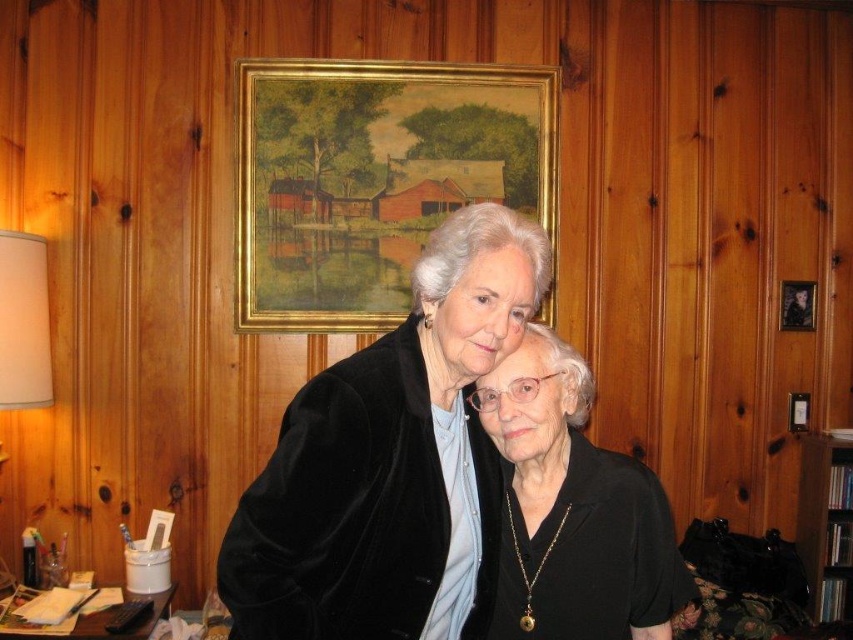
Is velvet black jacket at center below white fabric lampshade at left?

Yes.

Is velvet black jacket at center closer to camera compared to white fabric lampshade at left?

Yes, velvet black jacket at center is in front of white fabric lampshade at left.

Locate an element on the screen. velvet black jacket at center is located at coordinates (392, 461).

You are a GUI agent. You are given a task and a screenshot of the screen. Output one action in this format:
    pyautogui.click(x=<x>, y=<y>)
    Task: Click on the velvet black jacket at center
    This screenshot has width=853, height=640.
    Given the screenshot: What is the action you would take?
    pyautogui.click(x=392, y=461)

Between point (834, 554) and point (799, 324), which one is positioned in front?

Point (834, 554) is more forward.

Which is more to the left, wooden bookshelf at right or wooden picture frame at upper right?

wooden picture frame at upper right is more to the left.

Is point (838, 556) positioned after point (808, 291)?

No, it is not.

Identify the location of wooden bookshelf at right. The width and height of the screenshot is (853, 640). (827, 525).

Can you confirm if white fabric lampshade at left is bigger than wooden picture frame at upper right?

Yes.

Between white fabric lampshade at left and wooden picture frame at upper right, which one has less height?

wooden picture frame at upper right

Does point (39, 248) come closer to viewer compared to point (798, 328)?

Yes, point (39, 248) is closer to viewer.

Where is `white fabric lampshade at left`? The width and height of the screenshot is (853, 640). white fabric lampshade at left is located at coordinates (22, 321).